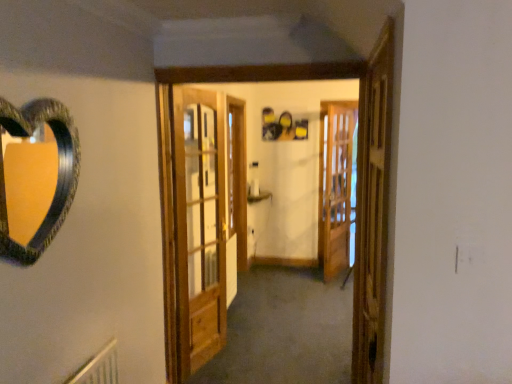
Where is `vacant area that lies between wooden barn door at center and wooden screen door at center, which is the 1th screen door in right-to-left order`? vacant area that lies between wooden barn door at center and wooden screen door at center, which is the 1th screen door in right-to-left order is located at coordinates (281, 308).